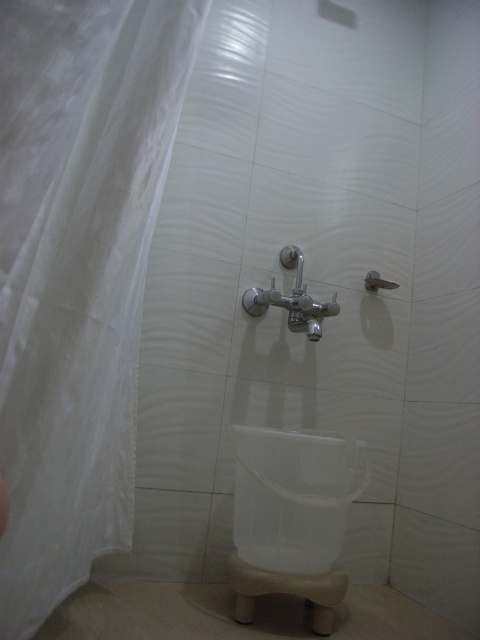
Question: Is white sheer curtain at left smaller than matte silver shower at upper center?

Choices:
 (A) yes
 (B) no

Answer: (B)

Question: Among these points, which one is farthest from the camera?

Choices:
 (A) (373, 284)
 (B) (249, 308)

Answer: (A)

Question: Is white sheer curtain at left below matte silver shower at upper center?

Choices:
 (A) no
 (B) yes

Answer: (B)

Question: Can you confirm if satin nickel faucet at center is wider than matte silver shower at upper center?

Choices:
 (A) yes
 (B) no

Answer: (A)

Question: Which point is farther from the camera taking this photo?

Choices:
 (A) (260, 300)
 (B) (82, 408)

Answer: (A)

Question: Which point is closer to the camera?

Choices:
 (A) satin nickel faucet at center
 (B) matte silver shower at upper center

Answer: (A)